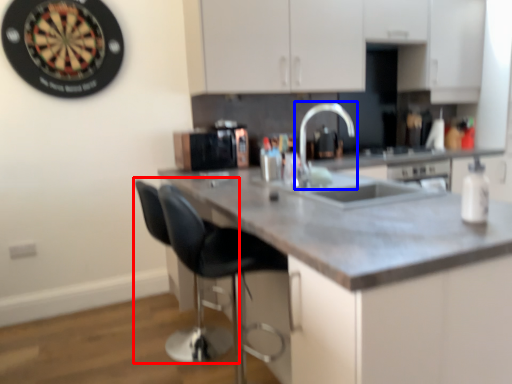
Question: Which object is further to the camera taking this photo, swivel chair (highlighted by a red box) or tap (highlighted by a blue box)?

Choices:
 (A) swivel chair
 (B) tap

Answer: (A)